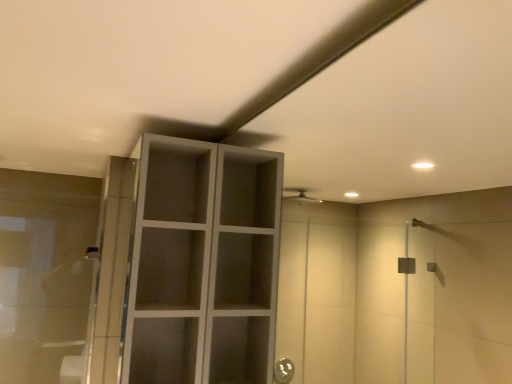
Question: Is the depth of matte gray cabinet at upper center less than that of transparent glass cabinet at left?

Choices:
 (A) yes
 (B) no

Answer: (A)

Question: Would you say transparent glass cabinet at left is part of matte gray cabinet at upper center's contents?

Choices:
 (A) no
 (B) yes

Answer: (A)

Question: Is matte gray cabinet at upper center not near transparent glass cabinet at left?

Choices:
 (A) no
 (B) yes

Answer: (B)

Question: Considering the relative sizes of matte gray cabinet at upper center and transparent glass cabinet at left in the image provided, is matte gray cabinet at upper center taller than transparent glass cabinet at left?

Choices:
 (A) no
 (B) yes

Answer: (B)

Question: Considering the relative sizes of matte gray cabinet at upper center and transparent glass cabinet at left in the image provided, is matte gray cabinet at upper center shorter than transparent glass cabinet at left?

Choices:
 (A) yes
 (B) no

Answer: (B)

Question: From a real-world perspective, is matte gray cabinet at upper center positioned under transparent glass cabinet at left based on gravity?

Choices:
 (A) no
 (B) yes

Answer: (A)

Question: Is transparent glass cabinet at left aimed at matte gray cabinet at upper center?

Choices:
 (A) no
 (B) yes

Answer: (A)

Question: Does transparent glass cabinet at left come in front of matte gray cabinet at upper center?

Choices:
 (A) no
 (B) yes

Answer: (A)

Question: Is transparent glass cabinet at left positioned far away from matte gray cabinet at upper center?

Choices:
 (A) yes
 (B) no

Answer: (A)

Question: Is transparent glass cabinet at left oriented away from matte gray cabinet at upper center?

Choices:
 (A) no
 (B) yes

Answer: (A)

Question: Can you confirm if transparent glass cabinet at left is taller than matte gray cabinet at upper center?

Choices:
 (A) yes
 (B) no

Answer: (B)

Question: Is transparent glass cabinet at left touching matte gray cabinet at upper center?

Choices:
 (A) no
 (B) yes

Answer: (A)

Question: Considering the positions of point (267, 342) and point (47, 274), is point (267, 342) closer or farther from the camera than point (47, 274)?

Choices:
 (A) farther
 (B) closer

Answer: (B)